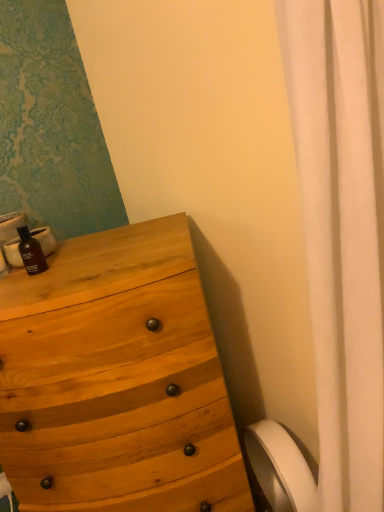
In order to click on white matte toilet paper at lower right in this screenshot , I will do `click(280, 467)`.

From the image's perspective, who appears lower, matte black bottle at left or white matte toilet paper at lower right?

white matte toilet paper at lower right appears lower in the image.

Is matte black bottle at left thinner than white matte toilet paper at lower right?

Yes, matte black bottle at left is thinner than white matte toilet paper at lower right.

Is matte black bottle at left to the right of white matte toilet paper at lower right from the viewer's perspective?

No, matte black bottle at left is not to the right of white matte toilet paper at lower right.

Is matte black bottle at left situated inside white matte toilet paper at lower right or outside?

The correct answer is: outside.

Does natural wood chest of drawers at left have a lesser width compared to white matte toilet paper at lower right?

No.

From the image's perspective, is natural wood chest of drawers at left under white matte toilet paper at lower right?

Incorrect, from the image's perspective, natural wood chest of drawers at left is higher than white matte toilet paper at lower right.

Which of these two, natural wood chest of drawers at left or white matte toilet paper at lower right, is bigger?

With larger size is natural wood chest of drawers at left.

Considering the positions of objects white matte toilet paper at lower right and matte black bottle at left in the image provided, who is more to the left, white matte toilet paper at lower right or matte black bottle at left?

matte black bottle at left.

Is point (258, 434) closer to camera compared to point (29, 255)?

No.

Is white matte toilet paper at lower right facing towards matte black bottle at left?

No, white matte toilet paper at lower right is not turned towards matte black bottle at left.

Is white matte toilet paper at lower right far away from matte black bottle at left?

No, there isn't a large distance between white matte toilet paper at lower right and matte black bottle at left.

Is matte black bottle at left facing towards natural wood chest of drawers at left?

No, matte black bottle at left does not turn towards natural wood chest of drawers at left.

Considering the relative sizes of matte black bottle at left and natural wood chest of drawers at left in the image provided, is matte black bottle at left wider than natural wood chest of drawers at left?

In fact, matte black bottle at left might be narrower than natural wood chest of drawers at left.

In the image, is matte black bottle at left positioned in front of or behind natural wood chest of drawers at left?

matte black bottle at left is positioned farther from the viewer than natural wood chest of drawers at left.

Which of these two, matte black bottle at left or natural wood chest of drawers at left, stands shorter?

Standing shorter between the two is matte black bottle at left.

In the scene shown: Which object is positioned more to the right, natural wood chest of drawers at left or matte black bottle at left?

From the viewer's perspective, natural wood chest of drawers at left appears more on the right side.

Is natural wood chest of drawers at left bigger or smaller than matte black bottle at left?

Clearly, natural wood chest of drawers at left is larger in size than matte black bottle at left.

Is matte black bottle at left at the back of natural wood chest of drawers at left?

No.

Which is closer, (118, 405) or (43, 258)?

The point (118, 405) is in front.

Is natural wood chest of drawers at left surrounded by white matte toilet paper at lower right?

That's incorrect, natural wood chest of drawers at left is not inside white matte toilet paper at lower right.

Measure the distance from white matte toilet paper at lower right to natural wood chest of drawers at left.

white matte toilet paper at lower right and natural wood chest of drawers at left are 20.21 inches apart.

Considering the relative positions of white matte toilet paper at lower right and natural wood chest of drawers at left in the image provided, is white matte toilet paper at lower right to the right of natural wood chest of drawers at left from the viewer's perspective?

Yes, white matte toilet paper at lower right is to the right of natural wood chest of drawers at left.

Considering the sizes of objects white matte toilet paper at lower right and natural wood chest of drawers at left in the image provided, who is taller, white matte toilet paper at lower right or natural wood chest of drawers at left?

With more height is natural wood chest of drawers at left.

At what (x,y) coordinates should I click in order to perform the action: click on bottle in front of the white matte toilet paper at lower right. Please return your answer as a coordinate pair (x, y). This screenshot has width=384, height=512. Looking at the image, I should click on (31, 252).

The width and height of the screenshot is (384, 512). Identify the location of chest of drawers above the white matte toilet paper at lower right (from the image's perspective). click(x=116, y=380).

Estimate the real-world distances between objects in this image. Which object is closer to white matte toilet paper at lower right, matte black bottle at left or natural wood chest of drawers at left?

natural wood chest of drawers at left is closer to white matte toilet paper at lower right.

Estimate the real-world distances between objects in this image. Which object is closer to matte black bottle at left, natural wood chest of drawers at left or white matte toilet paper at lower right?

natural wood chest of drawers at left is positioned closer to the anchor matte black bottle at left.

When comparing their distances from natural wood chest of drawers at left, does white matte toilet paper at lower right or matte black bottle at left seem further?

white matte toilet paper at lower right.

Estimate the real-world distances between objects in this image. Which object is closer to natural wood chest of drawers at left, matte black bottle at left or white matte toilet paper at lower right?

The object closer to natural wood chest of drawers at left is matte black bottle at left.

From the picture: Looking at the image, which one is located closer to white matte toilet paper at lower right, natural wood chest of drawers at left or matte black bottle at left?

Based on the image, natural wood chest of drawers at left appears to be nearer to white matte toilet paper at lower right.

Looking at the image, which one is located further to matte black bottle at left, white matte toilet paper at lower right or natural wood chest of drawers at left?

The object further to matte black bottle at left is white matte toilet paper at lower right.

At what (x,y) coordinates should I click in order to perform the action: click on chest of drawers between matte black bottle at left and white matte toilet paper at lower right in the vertical direction. Please return your answer as a coordinate pair (x, y). Looking at the image, I should click on (116, 380).